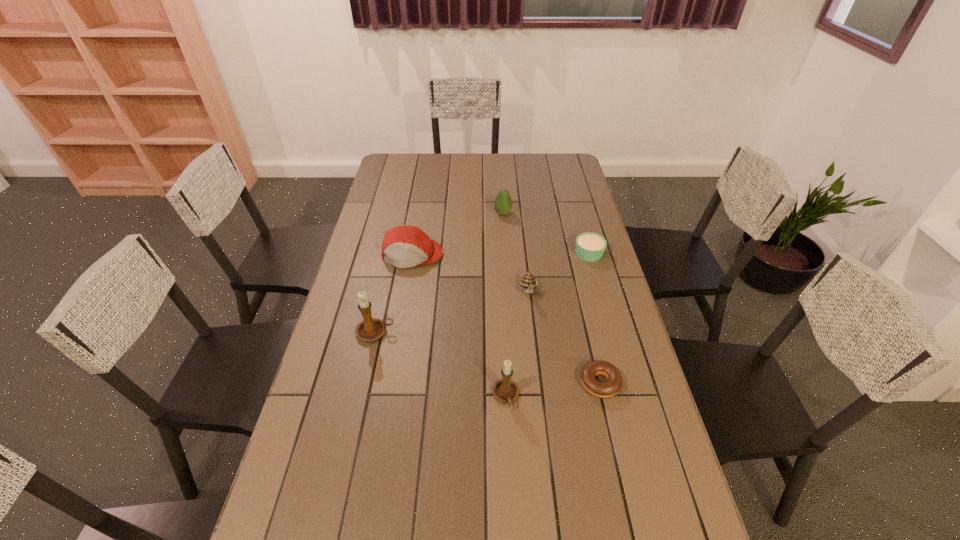
Find the location of `the farther candle holder`. the farther candle holder is located at coordinates (370, 329).

Locate an element on the screen. The image size is (960, 540). the taller candle holder is located at coordinates (370, 329).

This screenshot has width=960, height=540. I want to click on the right candle holder, so click(505, 390).

You are a GUI agent. You are given a task and a screenshot of the screen. Output one action in this format:
    pyautogui.click(x=<x>, y=<y>)
    Task: Click on the shorter candle holder
    
    Given the screenshot: What is the action you would take?
    pyautogui.click(x=505, y=390)

Find the location of a particular element. The image size is (960, 540). avocado is located at coordinates (503, 203).

The height and width of the screenshot is (540, 960). Find the location of `snail`. snail is located at coordinates (528, 282).

This screenshot has width=960, height=540. Find the location of `the fourth farthest object`. the fourth farthest object is located at coordinates (528, 282).

Find the location of a particular element. This screenshot has width=960, height=540. cap is located at coordinates (404, 246).

At what (x,y) coordinates should I click in order to perform the action: click on cupcake. Please return your answer as a coordinate pair (x, y). Looking at the image, I should click on (590, 247).

At what (x,y) coordinates should I click in order to perform the action: click on the shortest object. Please return your answer as a coordinate pair (x, y). This screenshot has height=540, width=960. Looking at the image, I should click on (607, 389).